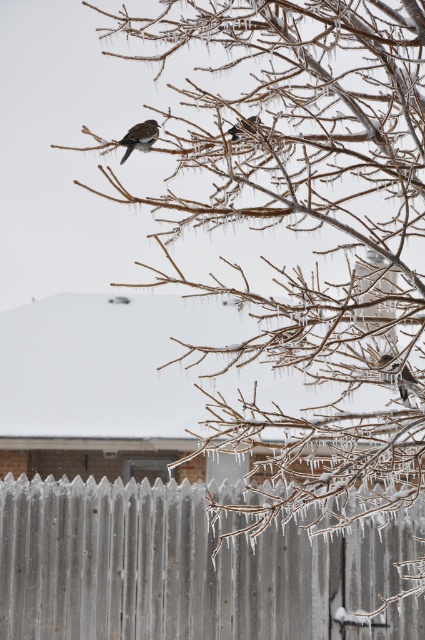
You are an ornithologist observing a winter scene with a tree covered in ice and snow. You notice a point marked at coordinates (139, 138). What object does this point represent?

The point at coordinates (139, 138) represents the brown speckled feathers at upper left.

You are an ornithologist observing a winter scene with a tree covered in ice and snow. You notice two sets of brown speckled feathers at upper right and brown speckled feathers at upper left. How far apart are these two sets of feathers?

The brown speckled feathers at upper right is 4.24 feet from brown speckled feathers at upper left.

Looking at this image, you are a bird with a nest made of brown speckled feathers located at the upper right of the winter scene. You want to land precisely on your nest. Given that your current position is at point coordinates [396,376], can you confirm if this point is part of your nest?

Yes, the point [396,376] is on the brown speckled feathers at upper right, which is your nest.